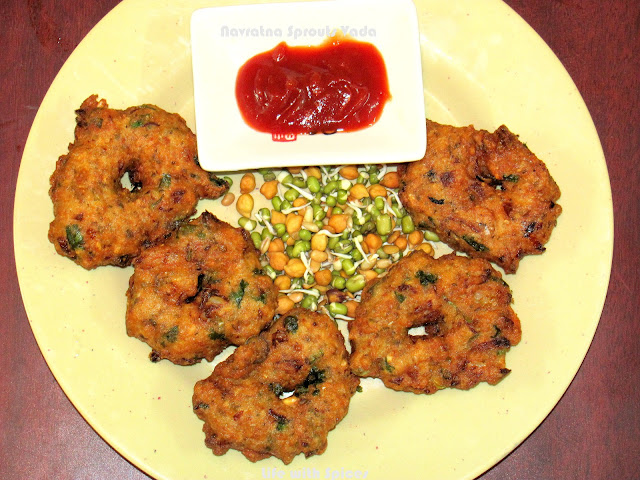
This screenshot has width=640, height=480. What are the coordinates of `table` in the screenshot? It's located at (564, 426).